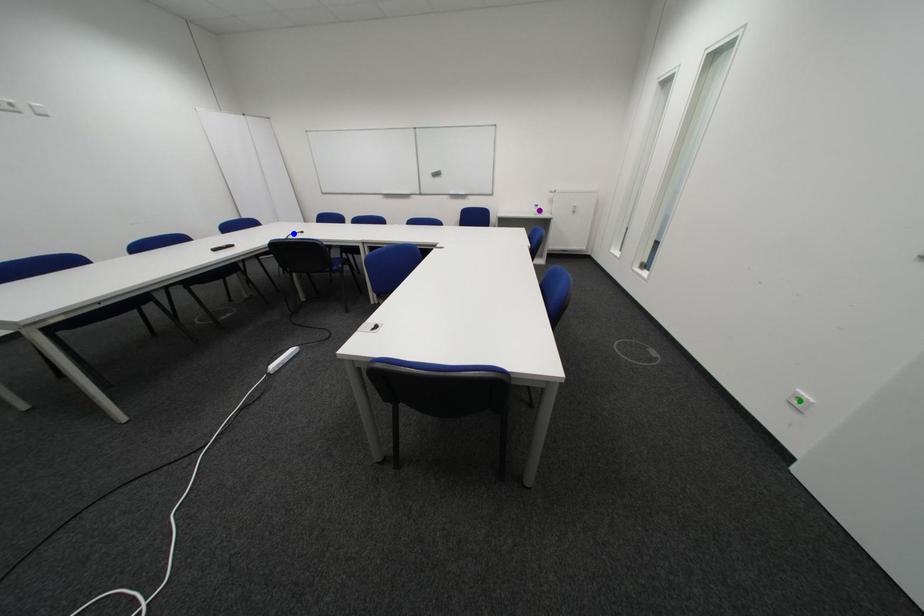
Order these from nearest to farthest:
- green point
- blue point
- purple point

green point
blue point
purple point